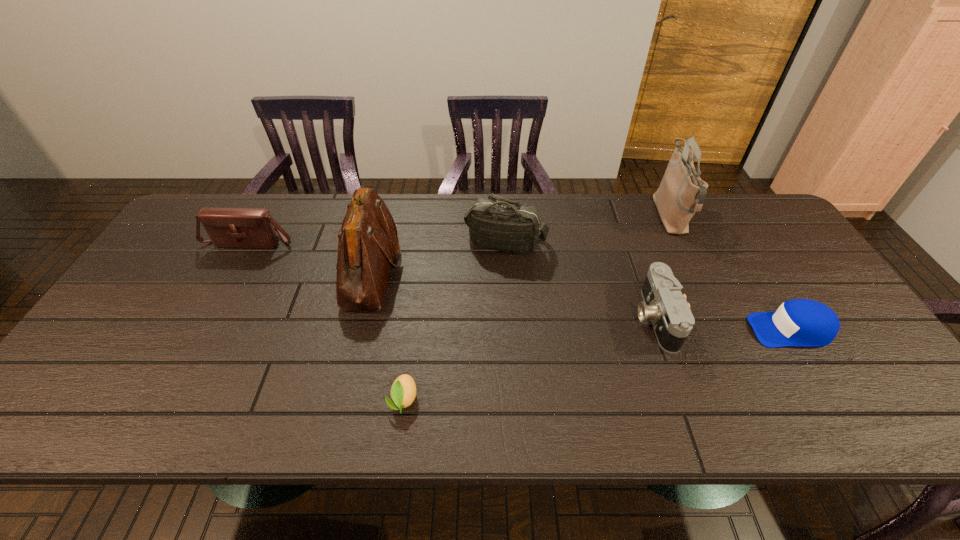
You are a GUI agent. You are given a task and a screenshot of the screen. Output one action in this format:
    pyautogui.click(x=<x>, y=<y>)
    Task: Click on the free space between the camera and the shortest shoulder bag
    The height and width of the screenshot is (540, 960).
    Given the screenshot: What is the action you would take?
    pyautogui.click(x=453, y=279)

Where is `object that stands as the sixth closest to the third shoulder bag from left to right`? This screenshot has width=960, height=540. object that stands as the sixth closest to the third shoulder bag from left to right is located at coordinates (799, 322).

Locate which object is the third closest to the lemon. Please provide its 2D coordinates. Your answer should be formatted as a tuple, i.e. [(x, y)], where the tuple contains the x and y coordinates of a point satisfying the conditions above.

[(672, 320)]

Where is `shoulder bag that is the closest to the sixth tallest object`? The image size is (960, 540). shoulder bag that is the closest to the sixth tallest object is located at coordinates (681, 193).

Find the location of a particular element. The width and height of the screenshot is (960, 540). shoulder bag object that ranks as the second closest to the rightmost shoulder bag is located at coordinates (367, 243).

Where is `vacant space that satisfies the following two spatial constraints: 1. on the front flap of the fourth tallest object; 2. on the right side of the sixth object from right to left`? This screenshot has width=960, height=540. vacant space that satisfies the following two spatial constraints: 1. on the front flap of the fourth tallest object; 2. on the right side of the sixth object from right to left is located at coordinates (235, 269).

Where is `blank space that satisfies the following two spatial constraints: 1. on the front-facing side of the baseball cap; 2. with leaves positioned above the lemon`? The image size is (960, 540). blank space that satisfies the following two spatial constraints: 1. on the front-facing side of the baseball cap; 2. with leaves positioned above the lemon is located at coordinates (832, 400).

Identify the location of free point that satisfies the following two spatial constraints: 1. on the front-facing side of the rightmost shoulder bag; 2. on the front side of the sixth object from right to left. The image size is (960, 540). (696, 269).

Where is `free region that satisfies the following two spatial constraints: 1. on the front-facing side of the second object from right to left; 2. with leaves positioned above the fifth object from right to left`? free region that satisfies the following two spatial constraints: 1. on the front-facing side of the second object from right to left; 2. with leaves positioned above the fifth object from right to left is located at coordinates (758, 400).

Find the location of `free spot that satisfies the following two spatial constraints: 1. on the front-facing side of the rightmost shoulder bag; 2. with leaves positioned above the fifth object from right to left`. free spot that satisfies the following two spatial constraints: 1. on the front-facing side of the rightmost shoulder bag; 2. with leaves positioned above the fifth object from right to left is located at coordinates (758, 400).